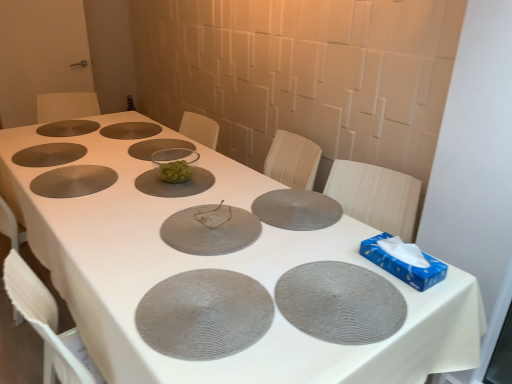
Where is `free region under matte gray glass plate at center, which ranks as the eighth glass plate in back-to-front order (from a real-world perspective)`? Image resolution: width=512 pixels, height=384 pixels. free region under matte gray glass plate at center, which ranks as the eighth glass plate in back-to-front order (from a real-world perspective) is located at coordinates (213, 224).